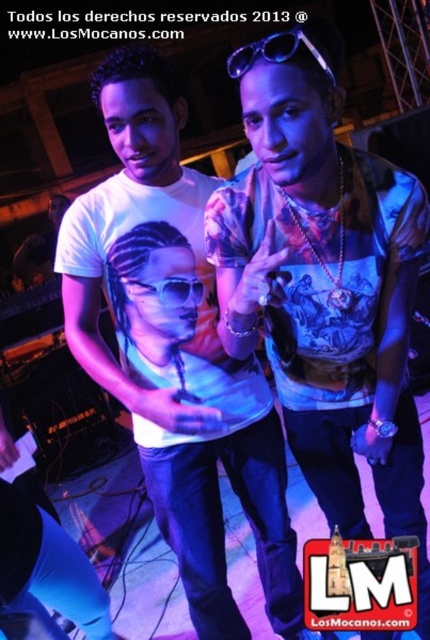
Between printed cotton shirt at center and transparent plastic goggles at center, which one is positioned higher?

transparent plastic goggles at center

Is printed cotton shirt at center wider than transparent plastic goggles at center?

Yes, printed cotton shirt at center is wider than transparent plastic goggles at center.

Between point (411, 285) and point (178, 285), which one is positioned behind?

Positioned behind is point (178, 285).

You are a GUI agent. You are given a task and a screenshot of the screen. Output one action in this format:
    pyautogui.click(x=<x>, y=<y>)
    Task: Click on the printed cotton shirt at center
    The image size is (430, 640).
    Given the screenshot: What is the action you would take?
    pyautogui.click(x=325, y=284)

Is matte white t-shirt at center wider than black plastic goggles at upper center?

Yes.

Does point (187, 269) come closer to viewer compared to point (239, 54)?

That is False.

What do you see at coordinates (175, 352) in the screenshot? The width and height of the screenshot is (430, 640). I see `matte white t-shirt at center` at bounding box center [175, 352].

Where is `matte white t-shirt at center`? matte white t-shirt at center is located at coordinates (175, 352).

Does point (301, 42) come in front of point (162, 284)?

Yes, point (301, 42) is in front of point (162, 284).

Describe the element at coordinates (275, 52) in the screenshot. This screenshot has height=640, width=430. I see `black plastic goggles at upper center` at that location.

Locate an element on the screen. This screenshot has height=640, width=430. black plastic goggles at upper center is located at coordinates (275, 52).